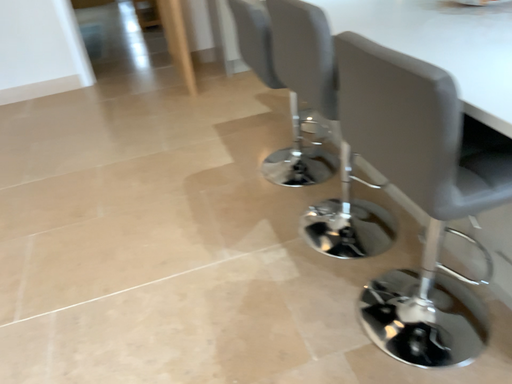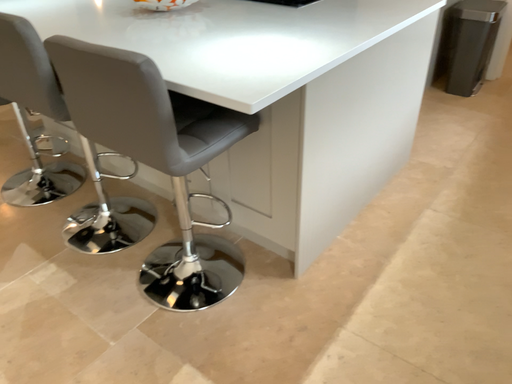
Question: How did the camera likely rotate when shooting the video?

Choices:
 (A) rotated left
 (B) rotated right

Answer: (B)